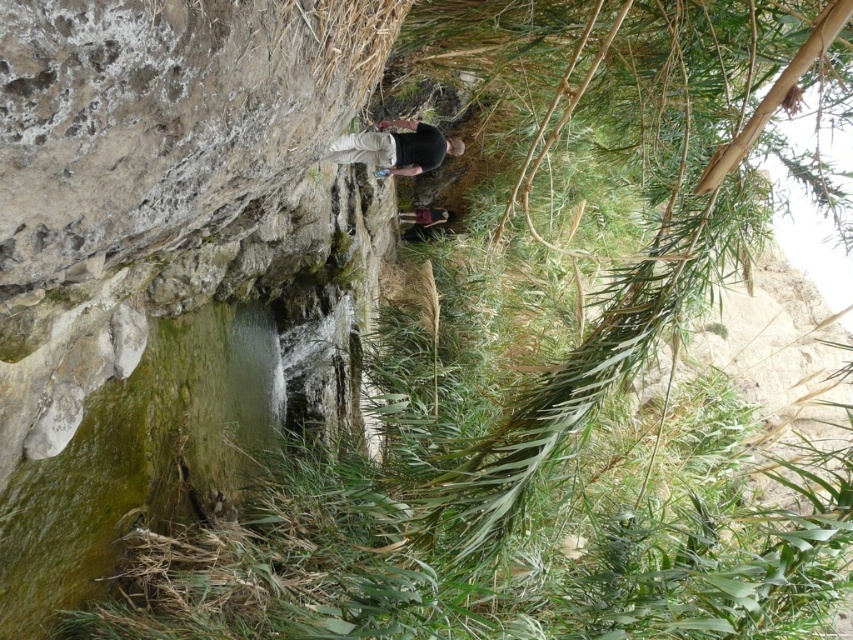
Question: Which of the following is the farthest from the observer?

Choices:
 (A) black matte shirt at center
 (B) rough stone cliff at upper left

Answer: (A)

Question: Which object is closer to the camera taking this photo?

Choices:
 (A) black matte shirt at center
 (B) rough stone cliff at upper left

Answer: (B)

Question: From the image, what is the correct spatial relationship of rough stone cliff at upper left in relation to black matte shirt at center?

Choices:
 (A) above
 (B) below

Answer: (B)

Question: Is rough stone cliff at upper left to the left of black matte shirt at center from the viewer's perspective?

Choices:
 (A) no
 (B) yes

Answer: (B)

Question: Is rough stone cliff at upper left to the right of black matte shirt at center from the viewer's perspective?

Choices:
 (A) no
 (B) yes

Answer: (A)